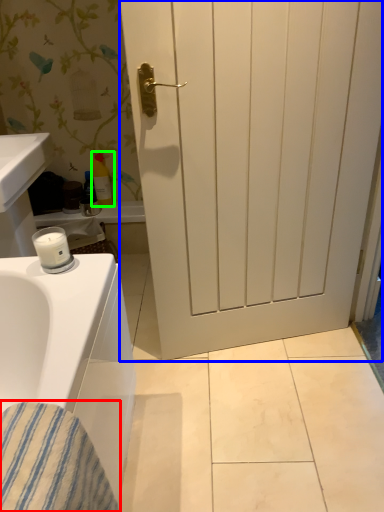
Question: Considering the real-world distances, which object is closest to material (highlighted by a red box)? door (highlighted by a blue box) or toiletry (highlighted by a green box).

Choices:
 (A) door
 (B) toiletry

Answer: (A)